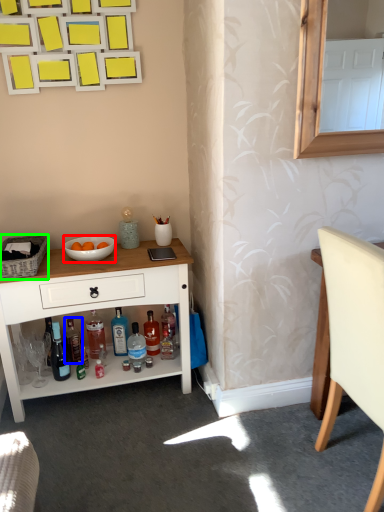
Question: Estimate the real-world distances between objects in this image. Which object is farther from bowl (highlighted by a red box), bottle (highlighted by a blue box) or picnic basket (highlighted by a green box)?

Choices:
 (A) bottle
 (B) picnic basket

Answer: (A)